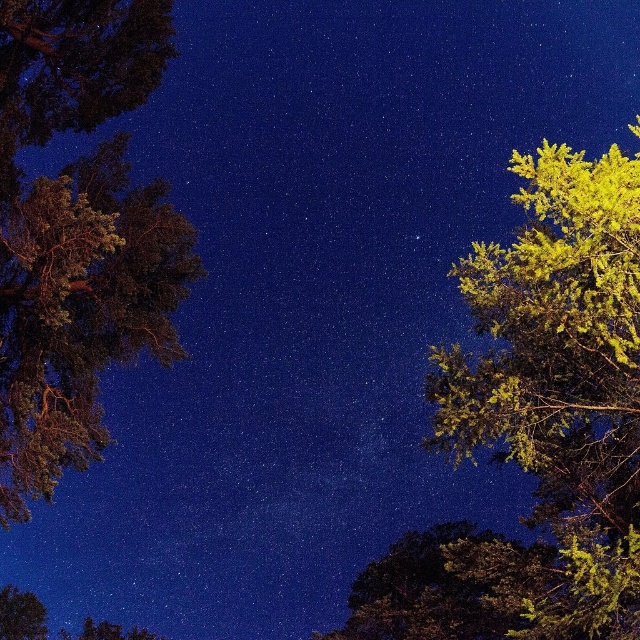
You are an astronomer observing the night sky and notice the green leafy tree at right and the dark green textured tree at left. Which tree is closer to the right edge of the image?

The green leafy tree at right is positioned on the right side of dark green textured tree at left, so it is closer to the right edge of the image.